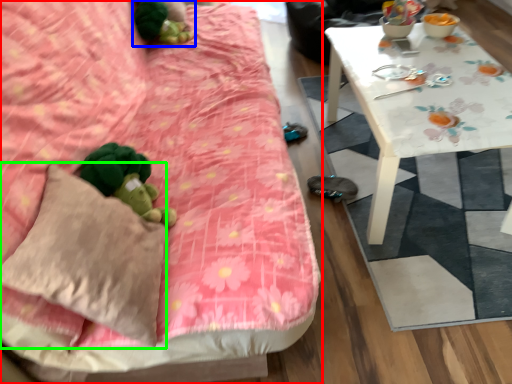
Question: Which object is positioned farthest from studio couch (highlighted by a red box)? Select from miniature (highlighted by a blue box) and throw pillow (highlighted by a green box).

Choices:
 (A) miniature
 (B) throw pillow

Answer: (A)